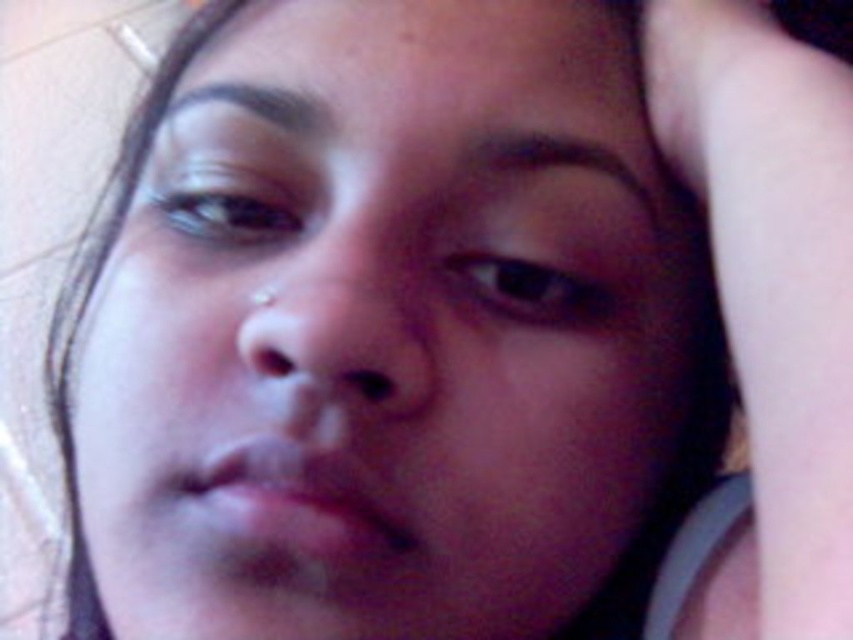
Question: In this image, where is pale skin arm at right located relative to brown matte eye at upper left?

Choices:
 (A) left
 (B) right

Answer: (B)

Question: From the image, what is the correct spatial relationship of pale skin arm at right in relation to brown matte eye at upper left?

Choices:
 (A) right
 (B) left

Answer: (A)

Question: Which point appears farthest from the camera in this image?

Choices:
 (A) tap(242, 230)
 (B) tap(579, 292)

Answer: (A)

Question: Can you confirm if pale skin arm at right is positioned to the left of brown matte eye at center?

Choices:
 (A) yes
 (B) no

Answer: (B)

Question: Which object is the closest to the pale skin arm at right?

Choices:
 (A) brown matte eye at upper left
 (B) brown matte eye at center

Answer: (B)

Question: Which of the following is the farthest from the observer?

Choices:
 (A) pale skin arm at right
 (B) brown matte eye at upper left

Answer: (B)